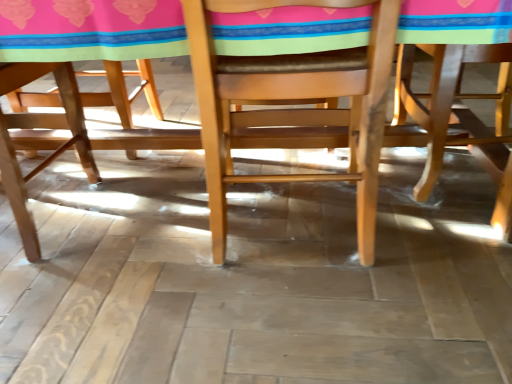
This screenshot has width=512, height=384. What do you see at coordinates (292, 102) in the screenshot? I see `wooden table at center` at bounding box center [292, 102].

The image size is (512, 384). Describe the element at coordinates (293, 102) in the screenshot. I see `natural wood chair at center, the second chair viewed from the right` at that location.

You are a GUI agent. You are given a task and a screenshot of the screen. Output one action in this format:
    pyautogui.click(x=<x>, y=<y>)
    Task: Click on the wooden table at center
    The image size is (512, 384).
    Given the screenshot: What is the action you would take?
    pyautogui.click(x=292, y=102)

Considering the positions of point (351, 119) and point (423, 111), is point (351, 119) closer or farther from the camera than point (423, 111)?

Point (351, 119) is closer to the camera than point (423, 111).

Are natural wood chair at center, the second chair viewed from the right, and light brown wood chair at right, marked as the first chair in a right-to-left arrangement, far apart?

No, natural wood chair at center, the second chair viewed from the right, is not far away from light brown wood chair at right, marked as the first chair in a right-to-left arrangement.

Based on their sizes in the image, would you say natural wood chair at center, the 1th chair in the left-to-right sequence, is bigger or smaller than light brown wood chair at right, marked as the first chair in a right-to-left arrangement?

natural wood chair at center, the 1th chair in the left-to-right sequence, is bigger than light brown wood chair at right, marked as the first chair in a right-to-left arrangement.

From the image's perspective, is natural wood chair at center, the 1th chair in the left-to-right sequence, above light brown wood chair at right, marked as the first chair in a right-to-left arrangement?

No, from the image's perspective, natural wood chair at center, the 1th chair in the left-to-right sequence, is not over light brown wood chair at right, marked as the first chair in a right-to-left arrangement.

This screenshot has width=512, height=384. What are the coordinates of `chair behind the wooden table at center` in the screenshot? It's located at (459, 117).

Are wooden table at center and light brown wood chair at right, marked as the first chair in a right-to-left arrangement, making contact?

They are not placed beside each other.

Is wooden table at center surrounding light brown wood chair at right, marked as the first chair in a right-to-left arrangement?

Yes, light brown wood chair at right, marked as the first chair in a right-to-left arrangement, is surrounded by wooden table at center.

Is light brown wood chair at right, marked as the 2th chair in a left-to-right arrangement, at the back of wooden table at center?

That's not correct — wooden table at center is not looking away from light brown wood chair at right, marked as the 2th chair in a left-to-right arrangement.

Considering the positions of point (508, 80) and point (346, 125), is point (508, 80) closer or farther from the camera than point (346, 125)?

Point (508, 80).

Choose the correct answer: Is light brown wood chair at right, marked as the first chair in a right-to-left arrangement, inside wooden table at center or outside it?

light brown wood chair at right, marked as the first chair in a right-to-left arrangement, exists entirely within wooden table at center.

Is light brown wood chair at right, marked as the 2th chair in a left-to-right arrangement, to the right of wooden table at center from the viewer's perspective?

Indeed, light brown wood chair at right, marked as the 2th chair in a left-to-right arrangement, is positioned on the right side of wooden table at center.

Is light brown wood chair at right, marked as the 2th chair in a left-to-right arrangement, taller or shorter than wooden table at center?

In the image, light brown wood chair at right, marked as the 2th chair in a left-to-right arrangement, appears to be shorter than wooden table at center.

Who is taller, light brown wood chair at right, marked as the 2th chair in a left-to-right arrangement, or natural wood chair at center, the 1th chair in the left-to-right sequence?

natural wood chair at center, the 1th chair in the left-to-right sequence, is taller.

How different are the orientations of light brown wood chair at right, marked as the 2th chair in a left-to-right arrangement, and natural wood chair at center, the second chair viewed from the right, in degrees?

They differ by 90 degrees in their facing directions.

Does light brown wood chair at right, marked as the 2th chair in a left-to-right arrangement, turn towards natural wood chair at center, the 1th chair in the left-to-right sequence?

Yes, light brown wood chair at right, marked as the 2th chair in a left-to-right arrangement, is turned towards natural wood chair at center, the 1th chair in the left-to-right sequence.

In the scene shown: From a real-world perspective, which object stands above the other?

In real-world perspective, natural wood chair at center, the second chair viewed from the right, is above.

Between natural wood chair at center, the second chair viewed from the right, and wooden table at center, which one has more height?

With more height is wooden table at center.

Considering the positions of objects natural wood chair at center, the second chair viewed from the right, and wooden table at center in the image provided, who is more to the right, natural wood chair at center, the second chair viewed from the right, or wooden table at center?

natural wood chair at center, the second chair viewed from the right, is more to the right.

Image resolution: width=512 pixels, height=384 pixels. Find the location of `table that appears behind the natural wood chair at center, the second chair viewed from the right`. table that appears behind the natural wood chair at center, the second chair viewed from the right is located at coordinates (292, 102).

In the scene shown: Can you confirm if natural wood chair at center, the second chair viewed from the right, is smaller than wooden table at center?

Yes.

The height and width of the screenshot is (384, 512). What are the coordinates of `chair that is the 2nd object located below the wooden table at center (from the image's perspective)` in the screenshot? It's located at (293, 102).

Which is correct: wooden table at center is inside natural wood chair at center, the second chair viewed from the right, or outside of it?

The correct answer is: outside.

Can you confirm if wooden table at center is wider than natural wood chair at center, the 1th chair in the left-to-right sequence?

Yes.

From the image's perspective, which one is positioned lower, wooden table at center or natural wood chair at center, the second chair viewed from the right?

natural wood chair at center, the second chair viewed from the right, is shown below in the image.

The image size is (512, 384). I want to click on chair behind the natural wood chair at center, the second chair viewed from the right, so click(x=459, y=117).

Find the location of `table lying in front of the light brown wood chair at right, marked as the 2th chair in a left-to-right arrangement`. table lying in front of the light brown wood chair at right, marked as the 2th chair in a left-to-right arrangement is located at coordinates (292, 102).

Estimate the real-world distances between objects in this image. Which object is closer to natural wood chair at center, the 1th chair in the left-to-right sequence, wooden table at center or light brown wood chair at right, marked as the 2th chair in a left-to-right arrangement?

wooden table at center.

From the image, which object appears to be nearer to light brown wood chair at right, marked as the 2th chair in a left-to-right arrangement, natural wood chair at center, the second chair viewed from the right, or wooden table at center?

wooden table at center lies closer to light brown wood chair at right, marked as the 2th chair in a left-to-right arrangement, than the other object.

Consider the image. Looking at the image, which one is located closer to wooden table at center, light brown wood chair at right, marked as the first chair in a right-to-left arrangement, or natural wood chair at center, the 1th chair in the left-to-right sequence?

Among the two, natural wood chair at center, the 1th chair in the left-to-right sequence, is located nearer to wooden table at center.

Which object lies further to the anchor point light brown wood chair at right, marked as the 2th chair in a left-to-right arrangement, wooden table at center or natural wood chair at center, the second chair viewed from the right?

Result: natural wood chair at center, the second chair viewed from the right, lies further to light brown wood chair at right, marked as the 2th chair in a left-to-right arrangement, than the other object.

Based on their spatial positions, is light brown wood chair at right, marked as the first chair in a right-to-left arrangement, or wooden table at center closer to natural wood chair at center, the second chair viewed from the right?

Based on the image, wooden table at center appears to be nearer to natural wood chair at center, the second chair viewed from the right.

Looking at the image, which one is located closer to wooden table at center, natural wood chair at center, the second chair viewed from the right, or light brown wood chair at right, marked as the first chair in a right-to-left arrangement?

natural wood chair at center, the second chair viewed from the right.

Where is `chair between wooden table at center and light brown wood chair at right, marked as the first chair in a right-to-left arrangement, in the horizontal direction`? chair between wooden table at center and light brown wood chair at right, marked as the first chair in a right-to-left arrangement, in the horizontal direction is located at coordinates (293, 102).